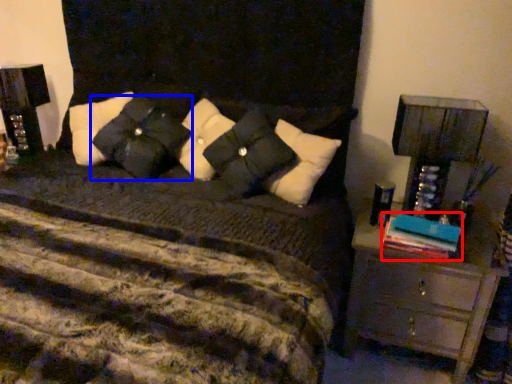
Question: Which of the following is the closest to the observer, book (highlighted by a red box) or pillow (highlighted by a blue box)?

Choices:
 (A) book
 (B) pillow

Answer: (A)